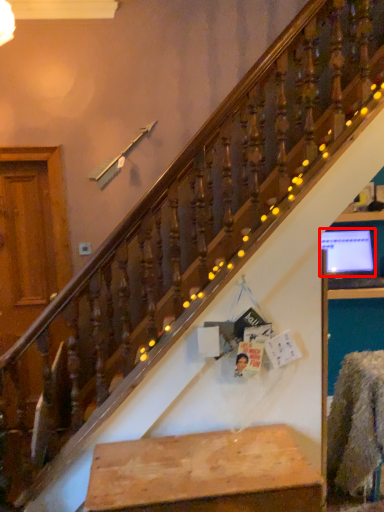
Question: In this image, where is computer monitor (annotated by the red box) located relative to furniture?

Choices:
 (A) right
 (B) left

Answer: (A)